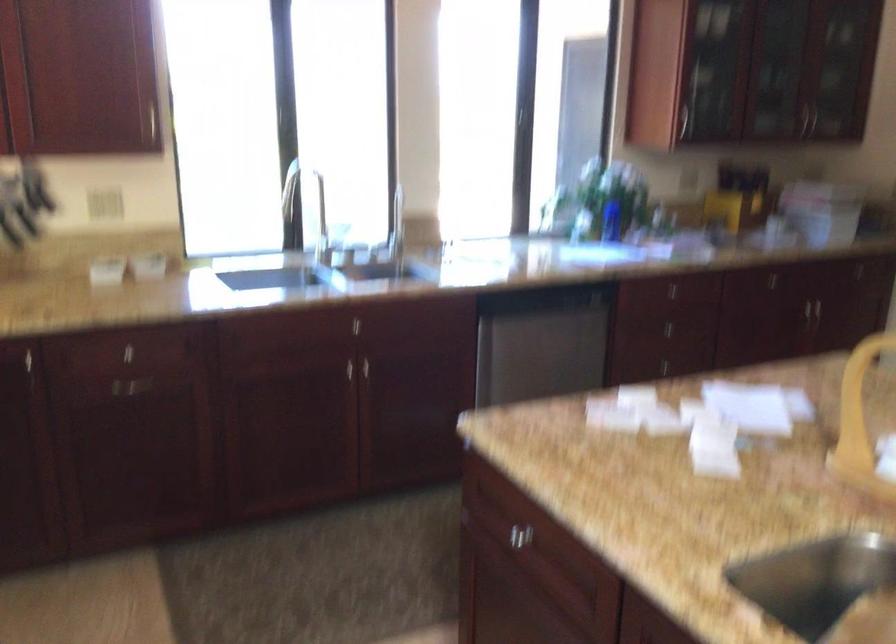
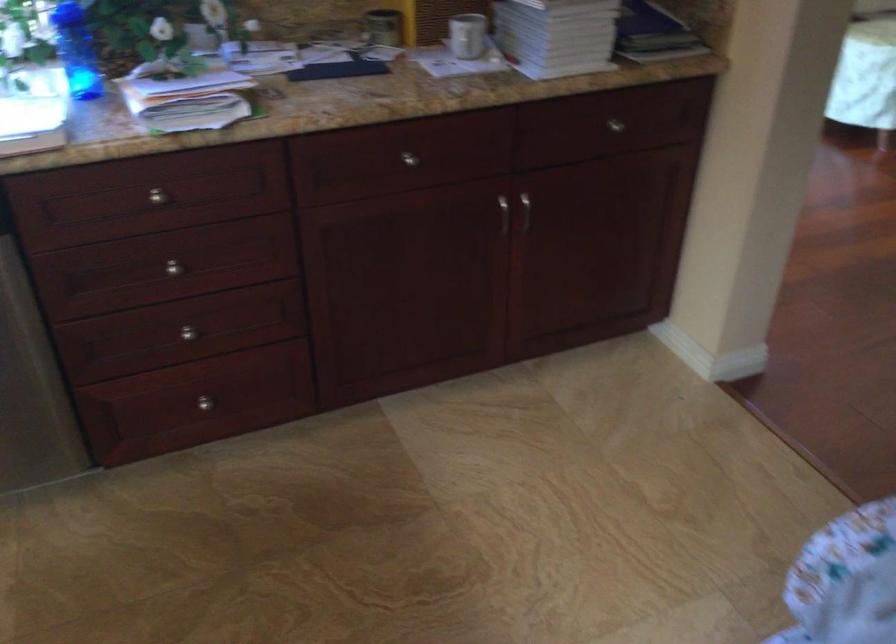
In a continuous first-person perspective shot, in which direction is the camera moving?

The cameraman moved toward right, forward.